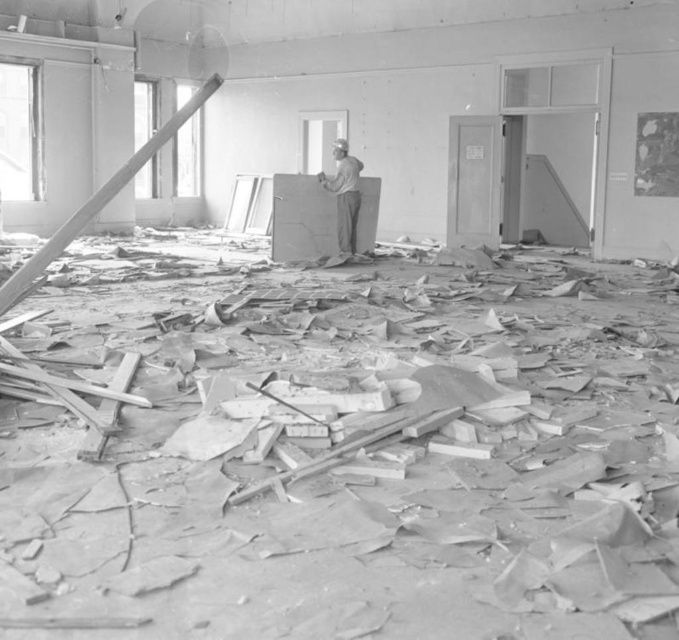
Question: Which of the following is the farthest from the observer?

Choices:
 (A) (39, 557)
 (B) (340, 172)

Answer: (B)

Question: Is crumbly concrete debris at center bigger than gray fabric cap at center?

Choices:
 (A) no
 (B) yes

Answer: (A)

Question: Observing the image, what is the correct spatial positioning of crumbly concrete debris at center in reference to gray fabric cap at center?

Choices:
 (A) above
 (B) below

Answer: (B)

Question: Can you confirm if crumbly concrete debris at center is positioned above gray fabric cap at center?

Choices:
 (A) yes
 (B) no

Answer: (B)

Question: Which point appears closest to the camera in this image?

Choices:
 (A) (335, 140)
 (B) (297, 403)

Answer: (B)